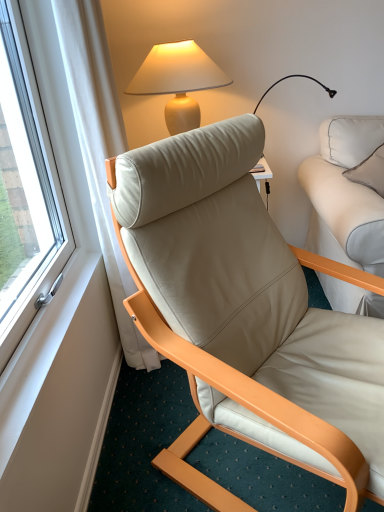
Question: Does point (372, 364) appear closer or farther from the camera than point (170, 44)?

Choices:
 (A) farther
 (B) closer

Answer: (B)

Question: In terms of width, does beige leather chair at center look wider or thinner when compared to matte beige lamp at upper center?

Choices:
 (A) wide
 (B) thin

Answer: (A)

Question: Which is farther from the beige leather chair at center?

Choices:
 (A) matte beige lamp at upper center
 (B) white leather pillow at upper right

Answer: (B)

Question: Which object is positioned closest to the white leather pillow at upper right?

Choices:
 (A) beige leather chair at center
 (B) matte beige lamp at upper center

Answer: (B)